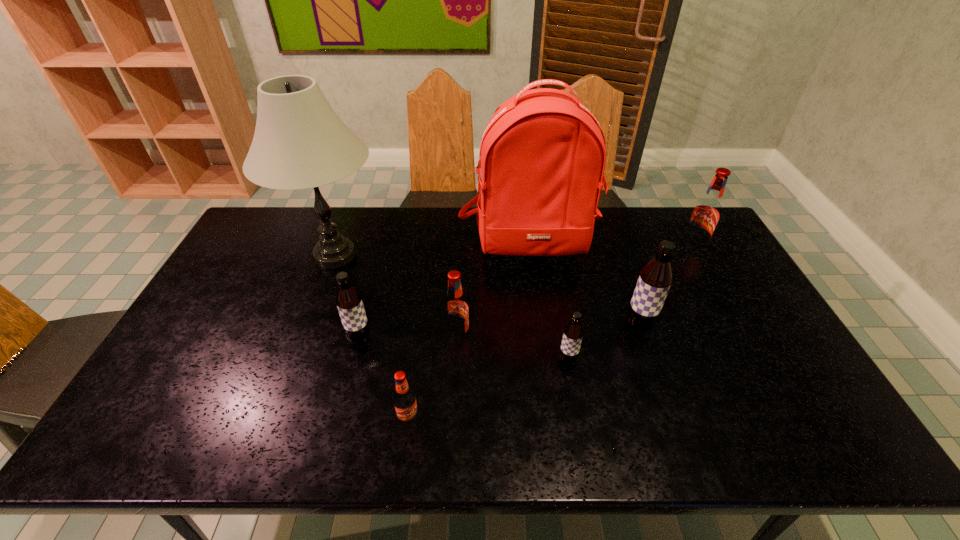
Where is `vacant space located on the front of the third root beer from right to left`? The image size is (960, 540). vacant space located on the front of the third root beer from right to left is located at coordinates (581, 437).

Where is `vacant region located 0.280m on the right of the nearest red root beer`? Image resolution: width=960 pixels, height=540 pixels. vacant region located 0.280m on the right of the nearest red root beer is located at coordinates (538, 420).

Locate an element on the screen. The image size is (960, 540). lamp present at the far edge is located at coordinates (299, 142).

Find the location of a particular element. backpack situated at the far edge is located at coordinates (542, 157).

Where is `root beer located at the far edge`? The width and height of the screenshot is (960, 540). root beer located at the far edge is located at coordinates (706, 213).

Image resolution: width=960 pixels, height=540 pixels. Find the location of `object positioned at the near edge`. object positioned at the near edge is located at coordinates (404, 398).

At what (x,y) coordinates should I click in order to perform the action: click on object located in the right edge section of the desktop. Please return your answer as a coordinate pair (x, y). The width and height of the screenshot is (960, 540). Looking at the image, I should click on (706, 213).

Where is `object that is at the far right corner`? This screenshot has height=540, width=960. object that is at the far right corner is located at coordinates [706, 213].

Find the location of a particular element. The image size is (960, 540). vacant space at the near edge of the desktop is located at coordinates (689, 431).

The width and height of the screenshot is (960, 540). In the image, there is a desktop. Find the location of `vacant space at the left edge`. vacant space at the left edge is located at coordinates (169, 412).